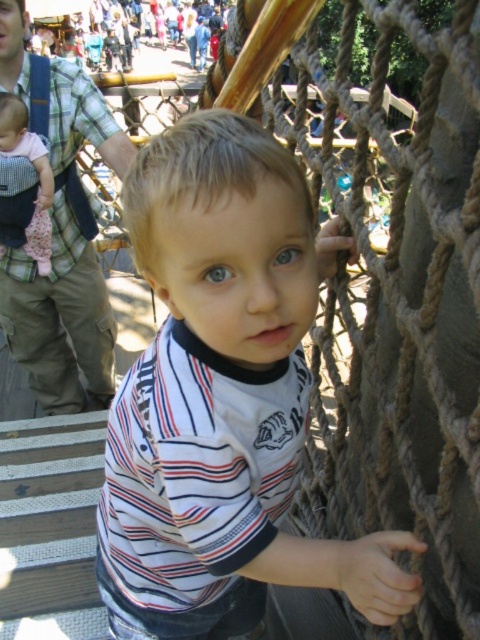
You are a photographer at the playground. You need to take a photo of the white striped shirt at center and the matte black baby carrier at left. Based on their positions, which object is closer to the right edge of the photo?

The white striped shirt at center is closer to the right edge of the photo because it is positioned to the right of the matte black baby carrier at left.

Consider the image. You are a photographer trying to capture the child in the white striped shirt at center. Based on the coordinates provided, where should you position your camera to ensure the shirt is in the frame?

The white striped shirt at center is located at point (223, 397), so you should position your camera to focus on that coordinate to capture the shirt in the frame.

Consider the image. You are a photographer trying to capture a clear shot of the white striped shirt at center and the matte black baby carrier at left. Since the camera can only focus on one object at a time, which object should you choose to ensure it appears sharp and in focus?

The white striped shirt at center should be chosen for focus because it is larger than the matte black baby carrier at left, making it easier to capture clearly.